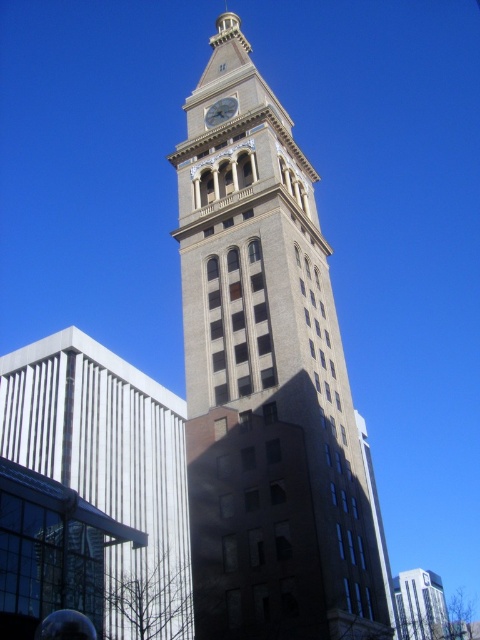
Is point (210, 200) farther from viewer compared to point (211, 124)?

No.

Between beige stone clock tower at center and gold metallic clock at center, which one is positioned higher?

gold metallic clock at center is above.

Who is more forward, (191, 168) or (208, 124)?

Point (191, 168) is in front.

The image size is (480, 640). Find the location of `beige stone clock tower at center`. beige stone clock tower at center is located at coordinates (266, 381).